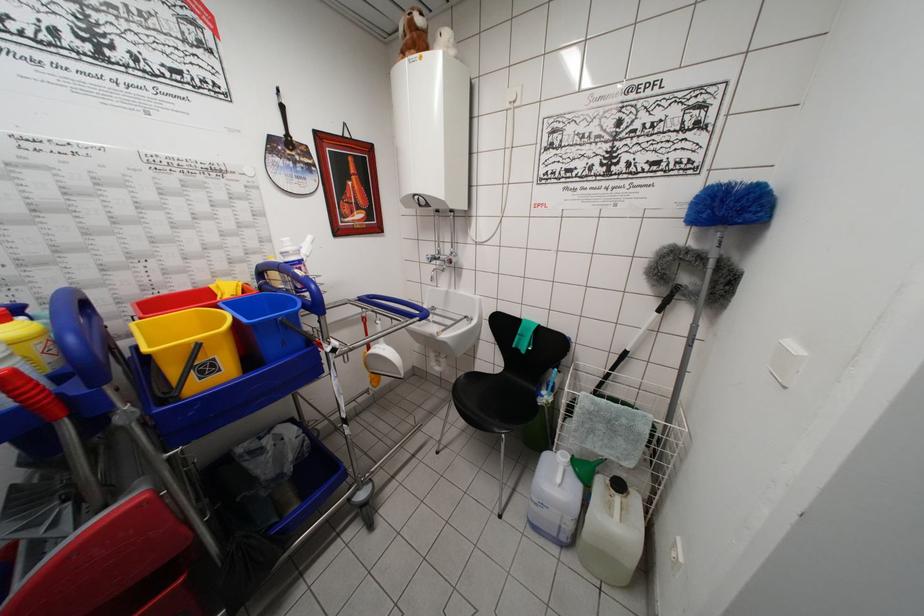
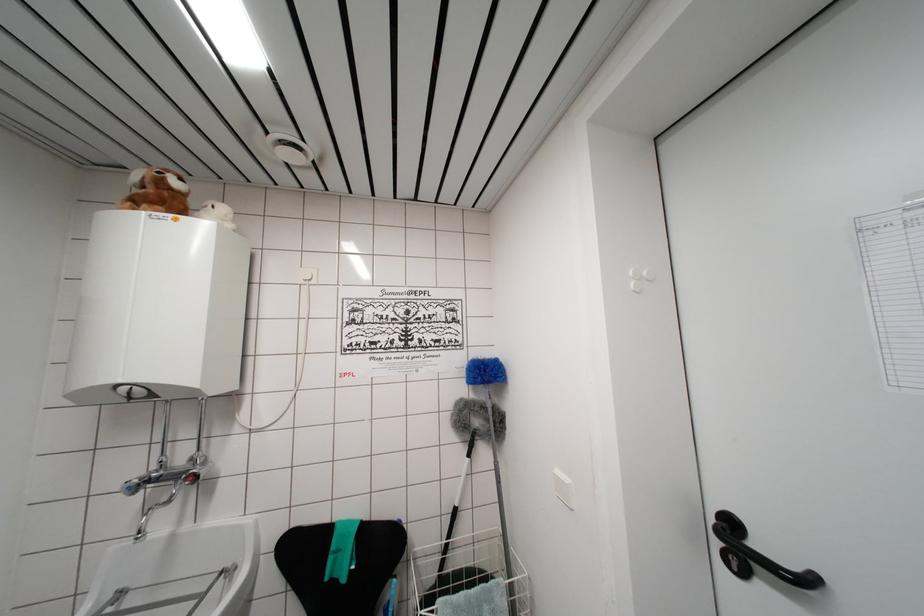
The point at (x=723, y=199) is marked in the first image. Where is the corresponding point in the second image?

(484, 371)